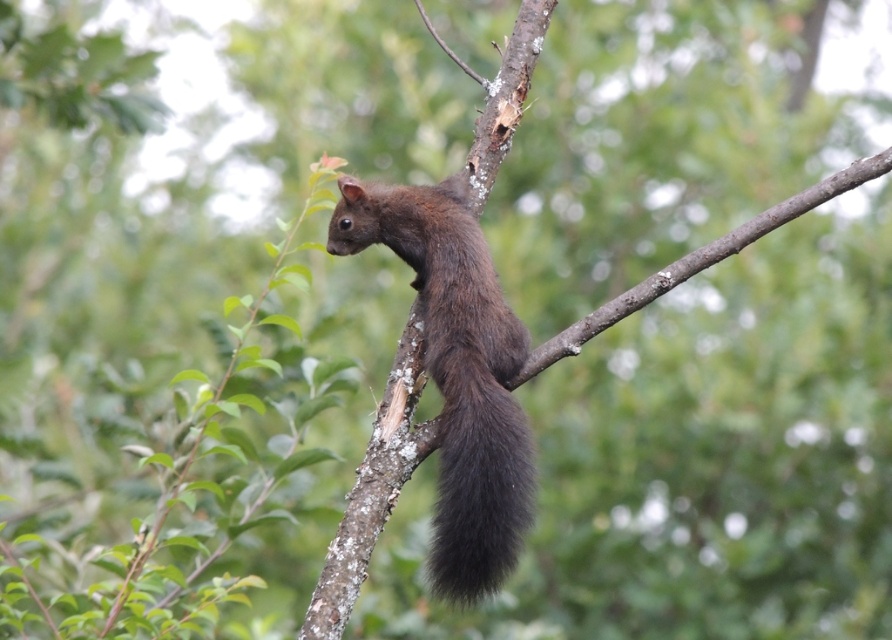
Question: Which point is closer to the camera?

Choices:
 (A) (472, 541)
 (B) (471, 472)

Answer: (A)

Question: Which point is closer to the camera?

Choices:
 (A) black fuzzy tail at center
 (B) shiny brown squirrel at center

Answer: (A)

Question: Is shiny brown squirrel at center smaller than black fuzzy tail at center?

Choices:
 (A) yes
 (B) no

Answer: (B)

Question: Which of the following is the farthest from the observer?

Choices:
 (A) black fuzzy tail at center
 (B) shiny brown squirrel at center

Answer: (B)

Question: Does shiny brown squirrel at center appear under black fuzzy tail at center?

Choices:
 (A) yes
 (B) no

Answer: (B)

Question: Is the position of shiny brown squirrel at center more distant than that of black fuzzy tail at center?

Choices:
 (A) no
 (B) yes

Answer: (B)